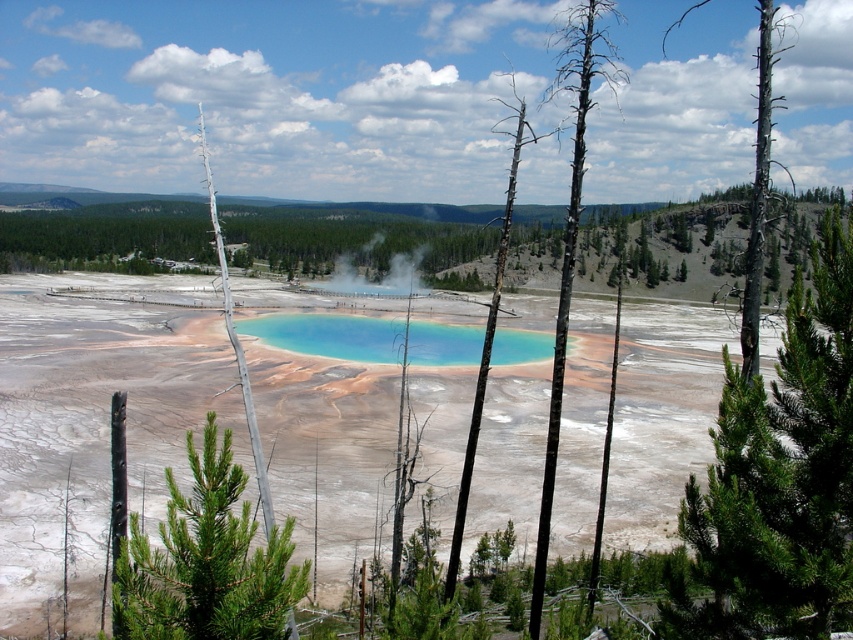
Based on the photo, you are a hiker standing at the edge of the geothermal pool and notice two points marked in the scene. Which point, point (125, 609) or point (566, 80), is closer to you?

Point (125, 609) is closer to you because it is in front of point (566, 80).